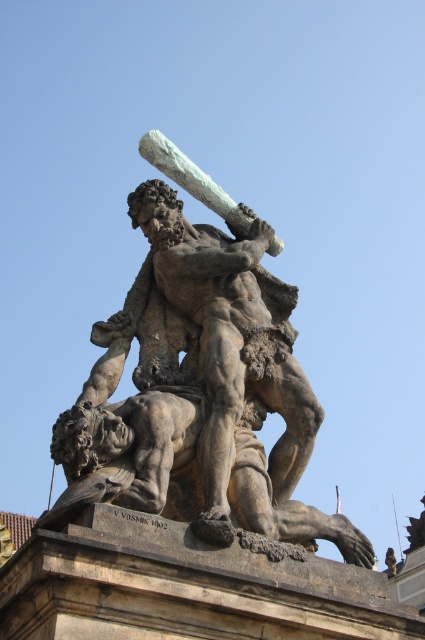
You are an art curator examining two stone sculptures in a gallery. The matte stone sculpture at center and the rough stone statue at center are both displayed in the same exhibition. Based on their positioning, which sculpture is located to the right of the other?

The matte stone sculpture at center is positioned on the right side of the rough stone statue at center, so it is located to the right of the rough stone statue at center.